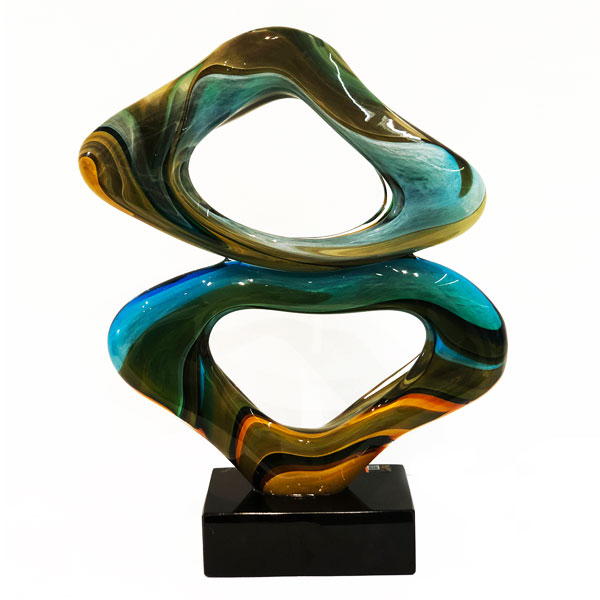
What are the coordinates of `the front of artwork stand` in the screenshot? It's located at (280, 557).